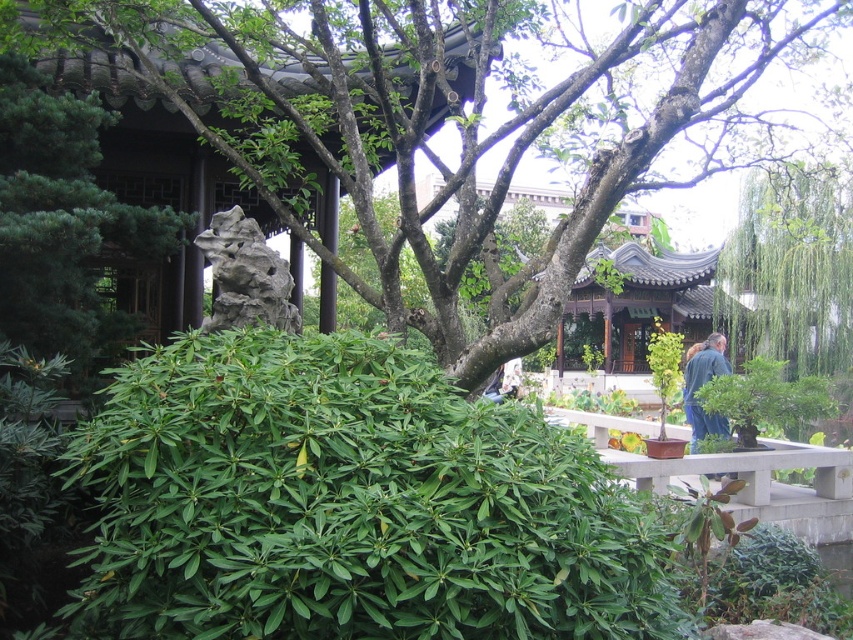
Question: Which is nearer to the blue denim jacket at lower right?

Choices:
 (A) gray stone rock at center
 (B) green leafy bush at right

Answer: (B)

Question: Can you confirm if green leafy bush at lower left is positioned below green matte tree at upper left?

Choices:
 (A) yes
 (B) no

Answer: (A)

Question: Is green leafy bush at center further to camera compared to blue denim jacket at lower right?

Choices:
 (A) no
 (B) yes

Answer: (A)

Question: Which object is farther from the camera taking this photo?

Choices:
 (A) gray stone rock at center
 (B) green leafy bush at center
 (C) green matte tree at upper left
 (D) blue denim jacket at lower right

Answer: (D)

Question: Is gray stone rock at center positioned behind green leafy bush at right?

Choices:
 (A) no
 (B) yes

Answer: (A)

Question: Which object appears closest to the camera in this image?

Choices:
 (A) green leafy bush at right
 (B) green leafy bush at center
 (C) blue denim jacket at lower right
 (D) green matte tree at upper left

Answer: (B)